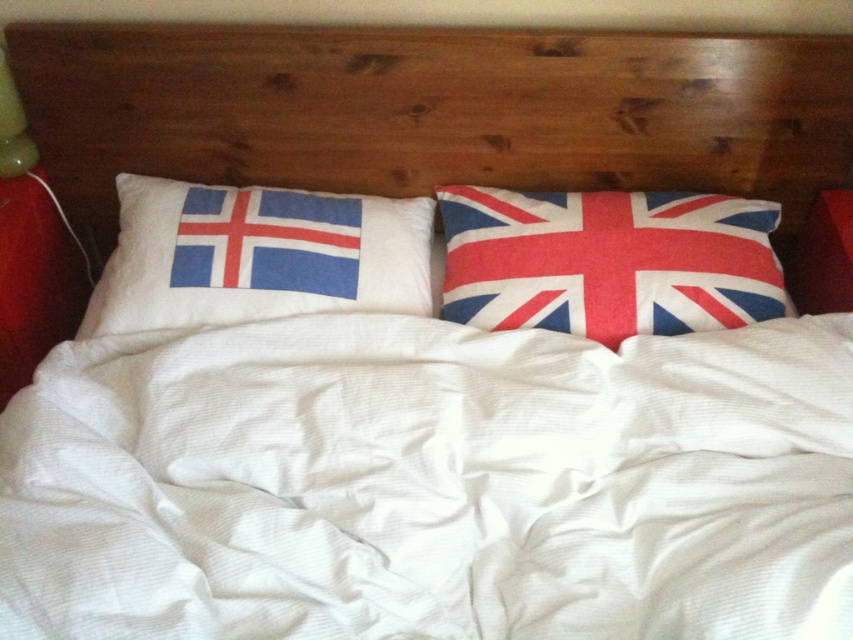
You are arranging a themed bedroom and need to place the textured cotton pillow with union jack design at right and the white cotton pillow with flag design at left on a shelf. The shelf has a height limit of 15 cm. Which pillow might not fit if the taller pillow is 16 cm tall?

The white cotton pillow with flag design at left might not fit on the shelf because it is taller than the textured cotton pillow with union jack design at right, and the shelf has a height limit of 15 cm. Since the taller pillow is 16 cm tall, it exceeds the shelf height limit.

You are a photographer positioned at the camera. You want to capture a closeup shot of the textured cotton pillow with union jack design at right. Given that your camera has a minimum focusing distance of 1.2 meters, will you be able to take the photo without moving closer?

The distance between the textured cotton pillow with union jack design at right and the camera is 1.37 meters. Since the minimum focusing distance is 1.2 meters, the camera can focus at that distance, so yes, you can take the closeup without moving closer.

You are arranging a travel theme bedroom. You have a wooden headboard at center and a white cotton pillow with flag design at left. Which object is closer to you when you are sitting on the bed?

The wooden headboard at center is closer to you because the white cotton pillow with flag design at left is behind it.